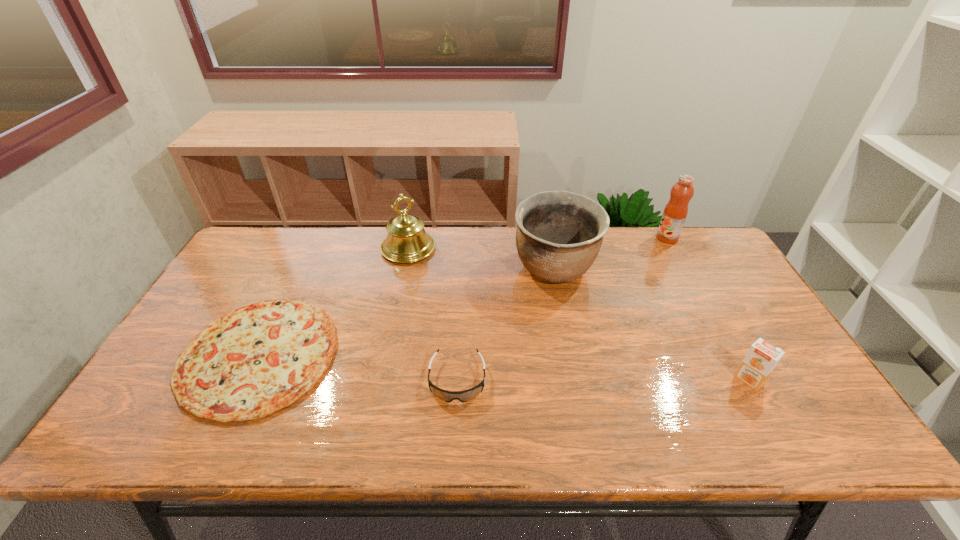
Identify which object is the third closest to the fruit juice. Please provide its 2D coordinates. Your answer should be formatted as a tuple, i.e. [(x, y)], where the tuple contains the x and y coordinates of a point satisfying the conditions above.

[(407, 241)]

Identify which object is the fourth closest to the fourth tallest object. Please provide its 2D coordinates. Your answer should be formatted as a tuple, i.e. [(x, y)], where the tuple contains the x and y coordinates of a point satisfying the conditions above.

[(407, 241)]

Where is `vacant position in the image that satisfies the following two spatial constraints: 1. on the front label of the fruit juice; 2. on the front and sides of the second shortest object`? This screenshot has height=540, width=960. vacant position in the image that satisfies the following two spatial constraints: 1. on the front label of the fruit juice; 2. on the front and sides of the second shortest object is located at coordinates (744, 380).